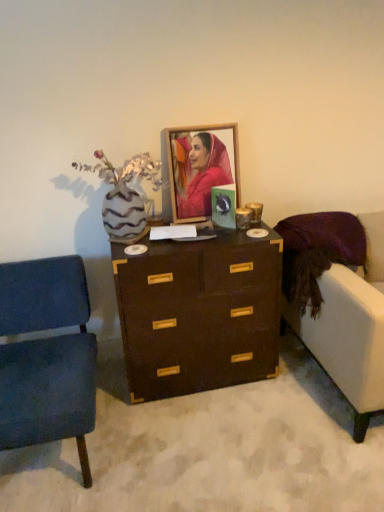
Question: Does velvet white couch at right have a greater height compared to brown wood chest of drawers at center?

Choices:
 (A) yes
 (B) no

Answer: (A)

Question: Is velvet white couch at right shorter than brown wood chest of drawers at center?

Choices:
 (A) yes
 (B) no

Answer: (B)

Question: From a real-world perspective, is velvet white couch at right on brown wood chest of drawers at center?

Choices:
 (A) yes
 (B) no

Answer: (A)

Question: Is velvet white couch at right to the right of brown wood chest of drawers at center from the viewer's perspective?

Choices:
 (A) no
 (B) yes

Answer: (B)

Question: Is velvet white couch at right oriented towards brown wood chest of drawers at center?

Choices:
 (A) no
 (B) yes

Answer: (A)

Question: Considering the relative sizes of velvet white couch at right and brown wood chest of drawers at center in the image provided, is velvet white couch at right bigger than brown wood chest of drawers at center?

Choices:
 (A) no
 (B) yes

Answer: (B)

Question: Does zebra-patterned vase with dried flowers at left turn towards brown wood chest of drawers at center?

Choices:
 (A) yes
 (B) no

Answer: (B)

Question: Does zebra-patterned vase with dried flowers at left contain brown wood chest of drawers at center?

Choices:
 (A) no
 (B) yes

Answer: (A)

Question: Considering the relative sizes of zebra-patterned vase with dried flowers at left and brown wood chest of drawers at center in the image provided, is zebra-patterned vase with dried flowers at left thinner than brown wood chest of drawers at center?

Choices:
 (A) no
 (B) yes

Answer: (B)

Question: From a real-world perspective, is zebra-patterned vase with dried flowers at left under brown wood chest of drawers at center?

Choices:
 (A) no
 (B) yes

Answer: (A)

Question: Does zebra-patterned vase with dried flowers at left have a larger size compared to brown wood chest of drawers at center?

Choices:
 (A) yes
 (B) no

Answer: (B)

Question: Does zebra-patterned vase with dried flowers at left have a greater width compared to brown wood chest of drawers at center?

Choices:
 (A) no
 (B) yes

Answer: (A)

Question: Is velvet blue chair at left smaller than brown wood chest of drawers at center?

Choices:
 (A) yes
 (B) no

Answer: (B)